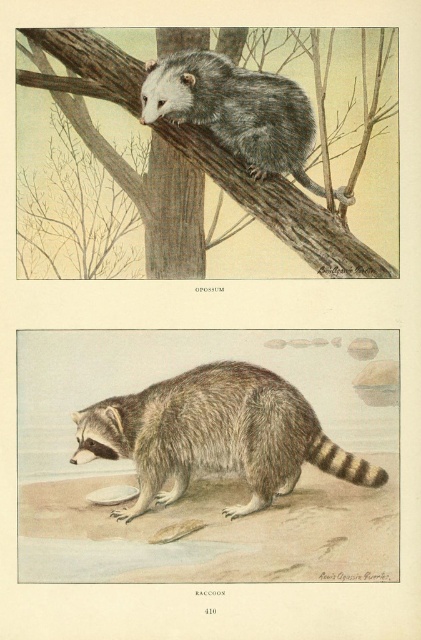
Question: Based on their relative distances, which object is farther from the brown fur raccoon at lower center?

Choices:
 (A) gray furry opossum at upper center
 (B) smooth brown tree trunk at upper center

Answer: (A)

Question: Where is brown fur raccoon at lower center located in relation to gray furry opossum at upper center in the image?

Choices:
 (A) below
 (B) above

Answer: (A)

Question: Which object appears closest to the camera in this image?

Choices:
 (A) brown fur raccoon at lower center
 (B) smooth brown tree trunk at upper center

Answer: (A)

Question: Which point is farther to the camera?

Choices:
 (A) gray furry opossum at upper center
 (B) brown fur raccoon at lower center
 (C) smooth brown tree trunk at upper center

Answer: (A)

Question: Is the position of brown fur raccoon at lower center more distant than that of gray furry opossum at upper center?

Choices:
 (A) yes
 (B) no

Answer: (B)

Question: Does smooth brown tree trunk at upper center lie behind gray furry opossum at upper center?

Choices:
 (A) yes
 (B) no

Answer: (B)